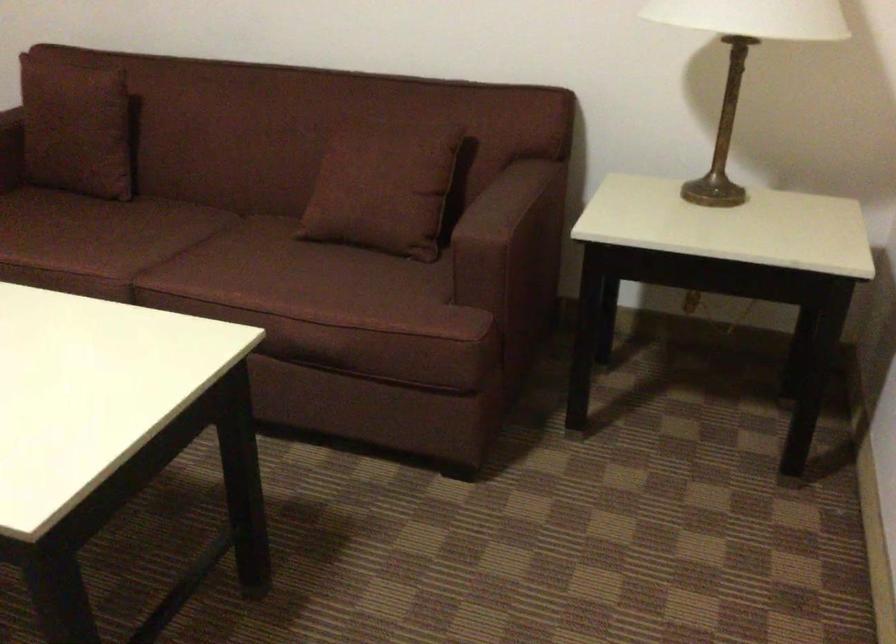
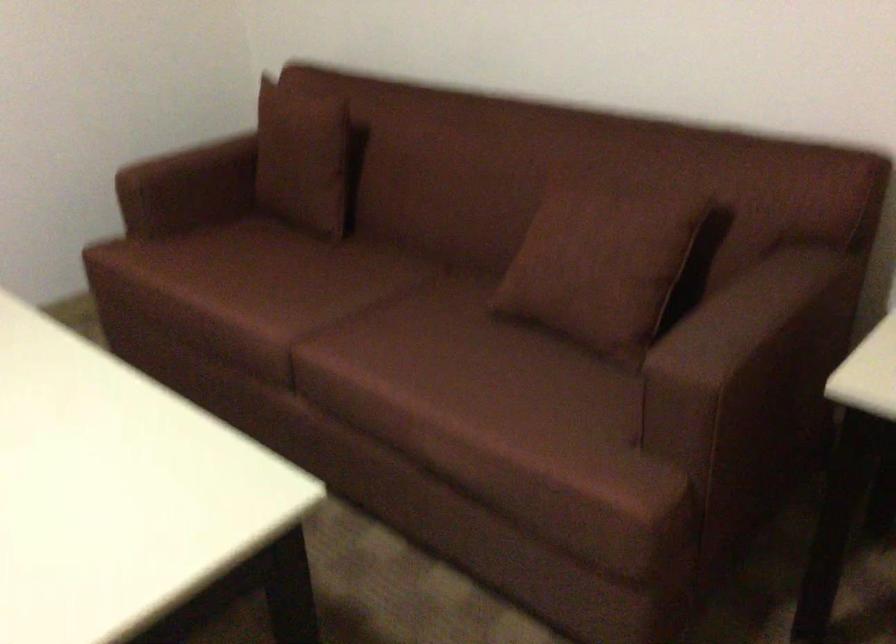
Where in the second image is the point corresponding to point (391, 181) from the first image?

(600, 263)